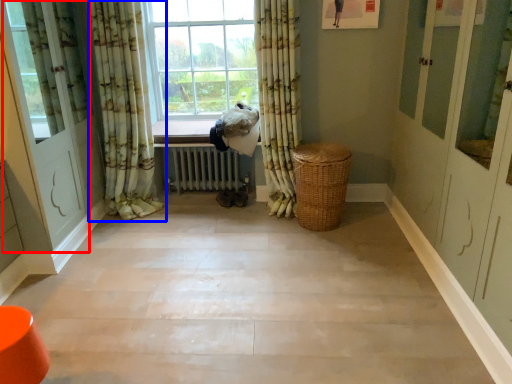
Question: Which of the following is the farthest to the observer, screen door (highlighted by a red box) or curtain (highlighted by a blue box)?

Choices:
 (A) screen door
 (B) curtain

Answer: (B)